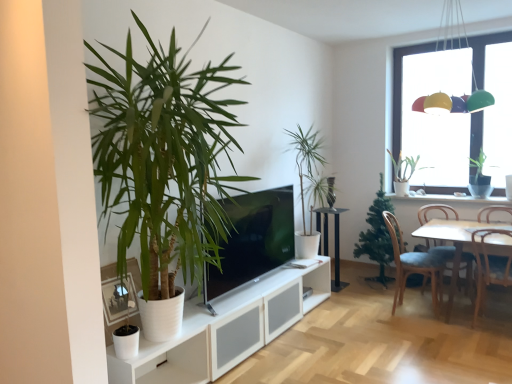
Question: Is wooden chair at lower right, the second chair from the right, outside brown wooden chair at right, marked as the 1th chair in a right-to-left arrangement?

Choices:
 (A) no
 (B) yes

Answer: (B)

Question: Can you confirm if wooden chair at lower right, positioned as the 3th chair in left-to-right order, is shorter than brown wooden chair at right, marked as the 1th chair in a right-to-left arrangement?

Choices:
 (A) no
 (B) yes

Answer: (B)

Question: From the image's perspective, is wooden chair at lower right, positioned as the 3th chair in left-to-right order, on brown wooden chair at right, the fourth chair positioned from the left?

Choices:
 (A) yes
 (B) no

Answer: (B)

Question: Does wooden chair at lower right, the second chair from the right, turn towards brown wooden chair at right, the fourth chair positioned from the left?

Choices:
 (A) no
 (B) yes

Answer: (B)

Question: Is wooden chair at lower right, positioned as the 3th chair in left-to-right order, bigger than brown wooden chair at right, the fourth chair positioned from the left?

Choices:
 (A) no
 (B) yes

Answer: (A)

Question: Is brown wooden chair at right, marked as the 1th chair in a right-to-left arrangement, inside wooden chair at lower right, positioned as the 3th chair in left-to-right order?

Choices:
 (A) yes
 (B) no

Answer: (B)

Question: Is green leafy plant at center, marked as the 4th houseplant in a right-to-left arrangement, smaller than matte black tv at center?

Choices:
 (A) yes
 (B) no

Answer: (B)

Question: From the image's perspective, is green leafy plant at center, arranged as the fourth houseplant when viewed from the back, beneath matte black tv at center?

Choices:
 (A) yes
 (B) no

Answer: (B)

Question: Does green leafy plant at center, acting as the 2th houseplant starting from the front, have a greater height compared to matte black tv at center?

Choices:
 (A) no
 (B) yes

Answer: (B)

Question: From a real-world perspective, is green leafy plant at center, marked as the 4th houseplant in a right-to-left arrangement, located beneath matte black tv at center?

Choices:
 (A) yes
 (B) no

Answer: (B)

Question: Is matte black tv at center a part of green leafy plant at center, which appears as the second houseplant when viewed from the left?

Choices:
 (A) yes
 (B) no

Answer: (B)

Question: Considering the relative sizes of green leafy plant at center, arranged as the fourth houseplant when viewed from the back, and matte black tv at center in the image provided, is green leafy plant at center, arranged as the fourth houseplant when viewed from the back, bigger than matte black tv at center?

Choices:
 (A) yes
 (B) no

Answer: (A)

Question: Is white wooden table at right, which is the second table from left to right, bigger than blue fabric chair at lower right, which is the fourth chair from right to left?

Choices:
 (A) no
 (B) yes

Answer: (B)